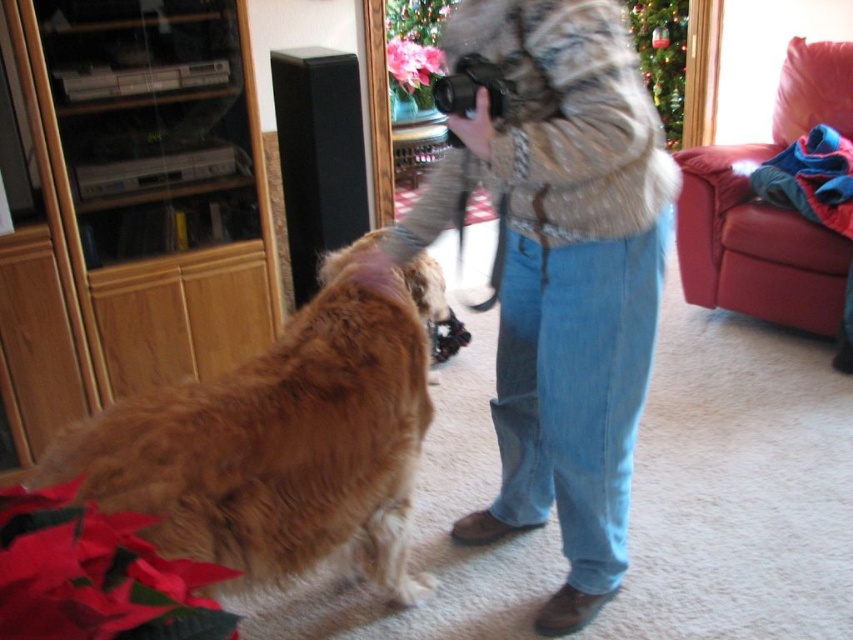
Is point (352, 260) in front of point (657, 154)?

No, it is not.

Is golden fur dog at center closer to the viewer compared to fuzzy brown fur coat at center?

Yes.

Which is in front, point (431, 586) or point (596, 104)?

Positioned in front is point (596, 104).

I want to click on golden fur dog at center, so click(282, 440).

Can you confirm if fuzzy fur hat at center is positioned above pink matte poinsettia at upper center?

Incorrect, fuzzy fur hat at center is not positioned above pink matte poinsettia at upper center.

Can you confirm if fuzzy fur hat at center is shorter than pink matte poinsettia at upper center?

In fact, fuzzy fur hat at center may be taller than pink matte poinsettia at upper center.

Is point (560, 508) in front of point (409, 61)?

Yes.

Locate an element on the screen. The image size is (853, 640). fuzzy fur hat at center is located at coordinates (561, 273).

Does golden fur dog at center come in front of pink matte poinsettia at upper center?

Yes, it is.

How much distance is there between golden fur dog at center and pink matte poinsettia at upper center?

They are 10.22 feet apart.

Identify the location of golden fur dog at center. The height and width of the screenshot is (640, 853). (282, 440).

The image size is (853, 640). In order to click on golden fur dog at center in this screenshot , I will do `click(282, 440)`.